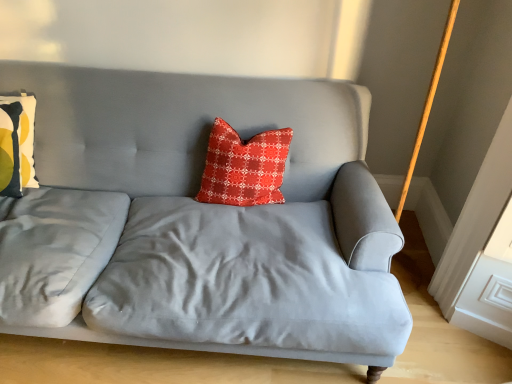
Question: Is matte yellow-green pillow at left, which is the 1th pillow from left to right, taller or shorter than satin gray couch at center?

Choices:
 (A) tall
 (B) short

Answer: (B)

Question: From a real-world perspective, is matte yellow-green pillow at left, which is the 1th pillow from left to right, physically located above or below satin gray couch at center?

Choices:
 (A) below
 (B) above

Answer: (B)

Question: Estimate the real-world distances between objects in this image. Which object is farther from the satin gray couch at center?

Choices:
 (A) red textured pillow at center, which is the second pillow in left-to-right order
 (B) matte yellow-green pillow at left, placed as the second pillow when sorted from right to left

Answer: (B)

Question: Estimate the real-world distances between objects in this image. Which object is closer to the red textured pillow at center, which is the second pillow in left-to-right order?

Choices:
 (A) matte yellow-green pillow at left, which is the 1th pillow from left to right
 (B) satin gray couch at center

Answer: (B)